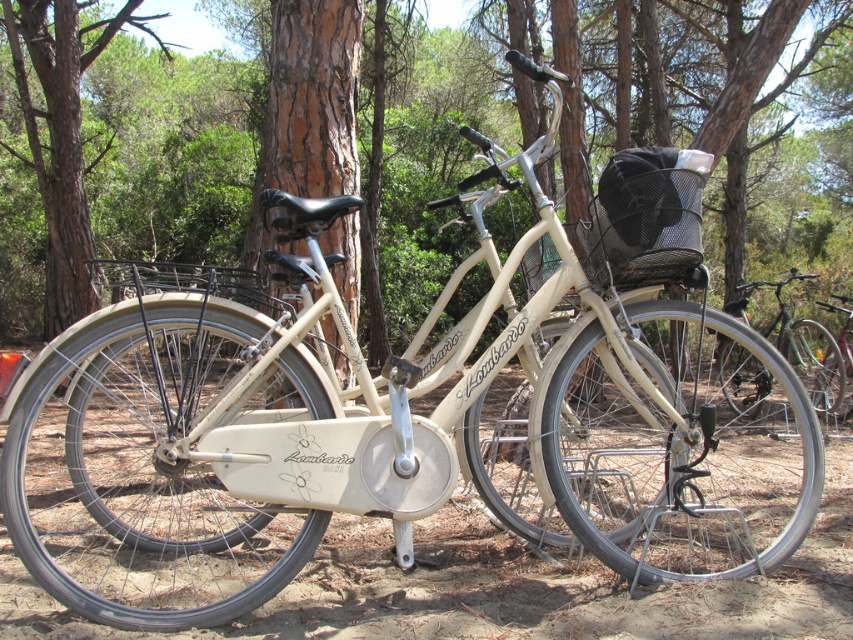
You are trying to determine which bicycle is narrower between the shiny silver bicycle at center and the metallic silver bicycle at center. Which one is narrower?

The shiny silver bicycle at center is narrower than the metallic silver bicycle at center.

You are standing at the point with coordinates closest to the front of the bicycle. Which of the two points, point (805, 355) or point (842, 330), is farther away from you?

Point (805, 355) is farther away from you because it is behind point (842, 330).